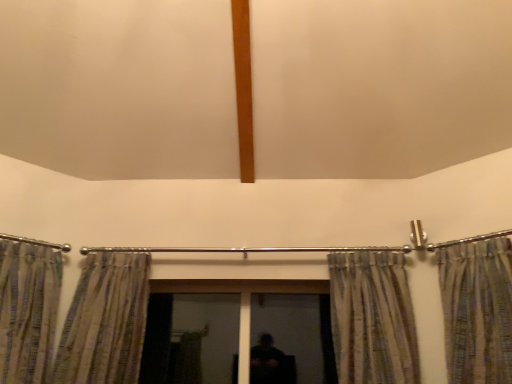
Question: Is striped fabric curtain at right, marked as the third curtain in a left-to-right arrangement, positioned in front of transparent glass screen door at center, the second screen door in the right-to-left sequence?

Choices:
 (A) no
 (B) yes

Answer: (B)

Question: Is striped fabric curtain at right, acting as the 2th curtain starting from the right, further to the viewer compared to transparent glass screen door at center, marked as the first screen door in a left-to-right arrangement?

Choices:
 (A) no
 (B) yes

Answer: (A)

Question: From a real-world perspective, is striped fabric curtain at right, marked as the third curtain in a left-to-right arrangement, on top of transparent glass screen door at center, marked as the first screen door in a left-to-right arrangement?

Choices:
 (A) no
 (B) yes

Answer: (B)

Question: Are striped fabric curtain at right, marked as the third curtain in a left-to-right arrangement, and transparent glass screen door at center, marked as the first screen door in a left-to-right arrangement, located far from each other?

Choices:
 (A) no
 (B) yes

Answer: (A)

Question: Could transparent glass screen door at center, marked as the first screen door in a left-to-right arrangement, be considered to be inside striped fabric curtain at right, acting as the 2th curtain starting from the right?

Choices:
 (A) yes
 (B) no

Answer: (B)

Question: From the image's perspective, relative to striped fabric curtain at left, the second curtain from the left, is transparent glass screen door at center, the second screen door in the right-to-left sequence, above or below?

Choices:
 (A) above
 (B) below

Answer: (B)

Question: Is point (145, 337) closer or farther from the camera than point (139, 284)?

Choices:
 (A) closer
 (B) farther

Answer: (B)

Question: Considering the positions of transparent glass screen door at center, marked as the first screen door in a left-to-right arrangement, and striped fabric curtain at left, the second curtain from the left, in the image, is transparent glass screen door at center, marked as the first screen door in a left-to-right arrangement, taller or shorter than striped fabric curtain at left, the second curtain from the left,?

Choices:
 (A) tall
 (B) short

Answer: (B)

Question: Is transparent glass screen door at center, the second screen door in the right-to-left sequence, wider or thinner than striped fabric curtain at left, the second curtain from the left?

Choices:
 (A) wide
 (B) thin

Answer: (B)

Question: Considering the positions of point (170, 337) and point (446, 274), is point (170, 337) closer or farther from the camera than point (446, 274)?

Choices:
 (A) closer
 (B) farther

Answer: (B)

Question: In terms of size, does transparent glass screen door at center, the second screen door in the right-to-left sequence, appear bigger or smaller than metallic striped curtain at right, which is counted as the first curtain, starting from the right?

Choices:
 (A) small
 (B) big

Answer: (A)

Question: From the image's perspective, is transparent glass screen door at center, the second screen door in the right-to-left sequence, located above or below metallic striped curtain at right, which is counted as the first curtain, starting from the right?

Choices:
 (A) above
 (B) below

Answer: (B)

Question: Choose the correct answer: Is transparent glass screen door at center, marked as the first screen door in a left-to-right arrangement, inside metallic striped curtain at right, which is counted as the first curtain, starting from the right, or outside it?

Choices:
 (A) inside
 (B) outside

Answer: (B)

Question: Does point (27, 327) appear closer or farther from the camera than point (94, 334)?

Choices:
 (A) closer
 (B) farther

Answer: (A)

Question: Considering the positions of striped fabric curtain at left, the 1th curtain from the left, and striped fabric curtain at left, the second curtain from the left, in the image, is striped fabric curtain at left, the 1th curtain from the left, wider or thinner than striped fabric curtain at left, the second curtain from the left,?

Choices:
 (A) wide
 (B) thin

Answer: (A)